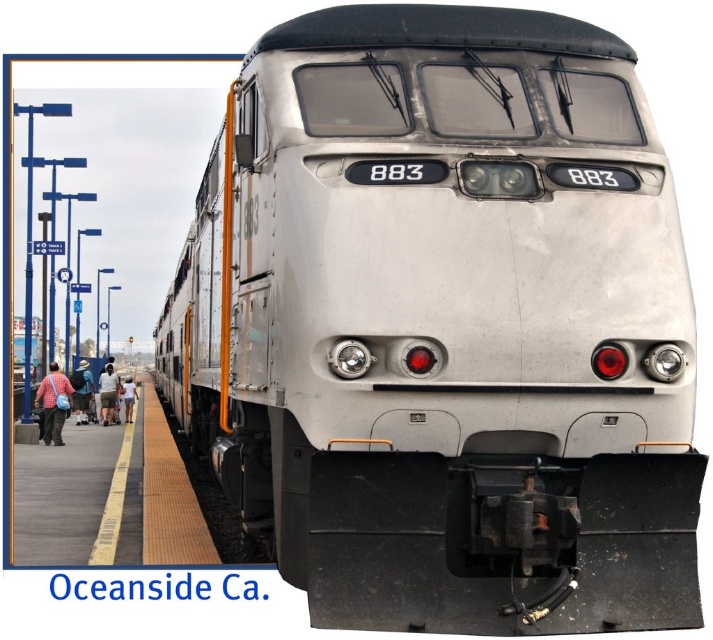
Is point (58, 388) farther from viewer compared to point (87, 397)?

No.

Between checkered shirt fabric at lower left and denim shorts at left, which one is positioned lower?

denim shorts at left is lower down.

This screenshot has width=713, height=640. Identify the location of checkered shirt fabric at lower left. (53, 403).

Between denim shorts at left and light brown fabric pants at lower left, which one appears on the left side from the viewer's perspective?

denim shorts at left is more to the left.

Who is positioned more to the right, denim shorts at left or light brown fabric pants at lower left?

From the viewer's perspective, light brown fabric pants at lower left appears more on the right side.

Is point (78, 376) closer to viewer compared to point (120, 394)?

Yes, point (78, 376) is closer to viewer.

Locate an element on the screen. denim shorts at left is located at coordinates (81, 392).

Does denim shorts at left appear on the right side of light blue denim shorts at lower left?

Incorrect, denim shorts at left is not on the right side of light blue denim shorts at lower left.

Does denim shorts at left have a lesser height compared to light blue denim shorts at lower left?

Yes, denim shorts at left is shorter than light blue denim shorts at lower left.

Does point (73, 392) lie in front of point (107, 378)?

No, (73, 392) is further to viewer.

Identify the location of denim shorts at left. (81, 392).